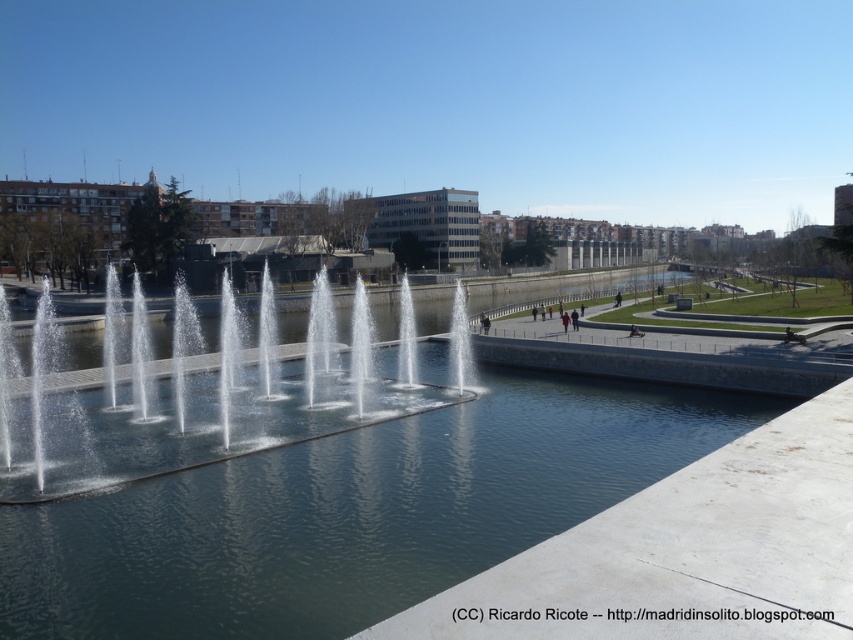
You are a park visitor standing at the edge of the water feature. You want to take a photo of the clear water at center and the clear water jets at center. Which one should you zoom in more on to capture the details of the smaller object?

The clear water at center has a smaller size compared to clear water jets at center, so you should zoom in more on the clear water at center to capture its details.

You are standing at the water feature in the urban park and want to take a photo of both the point at coordinates point (x=592, y=486) and point (x=248, y=388). Since you want both points to be in focus, which point should you focus on to ensure the other is also sharp?

You should focus on point (x=248, y=388) because it is farther from the camera than point (x=592, y=486). By focusing on the farther point, the closer point will also be within the depth of field, ensuring both are sharp.

You are standing at the entrance of the park and want to reach the clear water at center. Which direction should you walk to get there?

The clear water at center is located at point (352, 513), so you should walk towards the center of the park to reach it.